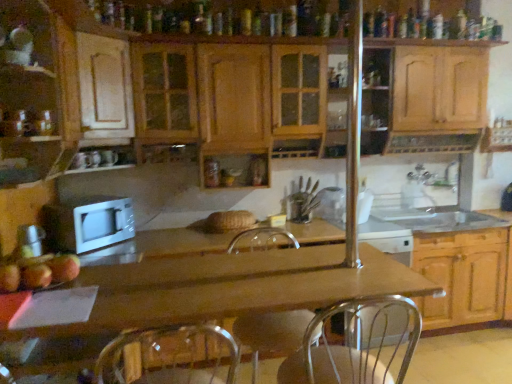
Question: From a real-world perspective, relative to wooden cabinet at lower right, the third cabinetry positioned from the left, is white matte microwave at center vertically above or below?

Choices:
 (A) above
 (B) below

Answer: (A)

Question: Visually, is white matte microwave at center positioned to the left or to the right of wooden cabinet at lower right, the third cabinetry positioned from the left?

Choices:
 (A) left
 (B) right

Answer: (A)

Question: Considering the real-world distances, which object is farthest from the clear glass jar at center?

Choices:
 (A) silver metallic faucet at upper right, arranged as the first faucet when viewed from the right
 (B) silver metallic faucet at sink right, placed as the first faucet when sorted from left to right
 (C) metallic silver swivel chair at center
 (D) wooden cabinets at center, acting as the second cabinetry starting from the left
 (E) matte wood cabinet at left, the 1th cabinetry from the left

Answer: (E)

Question: Which of these objects is positioned farthest from the silver metallic faucet at upper right, arranged as the first faucet when viewed from the right?

Choices:
 (A) wooden cabinet at lower right, which ranks as the first cabinetry in right-to-left order
 (B) wooden at center
 (C) red matte apple at lower left
 (D) metallic silver swivel chair at center
 (E) clear glass jar at center

Answer: (C)